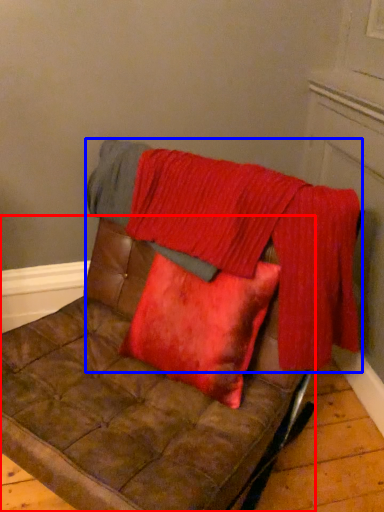
Question: Which of the following is the farthest to the observer, furniture (highlighted by a red box) or blanket (highlighted by a blue box)?

Choices:
 (A) furniture
 (B) blanket

Answer: (B)